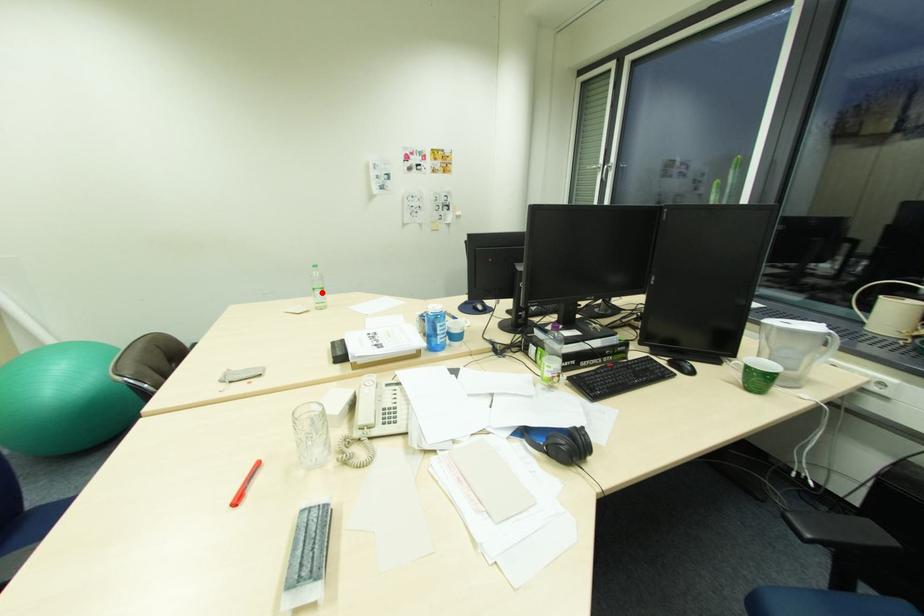
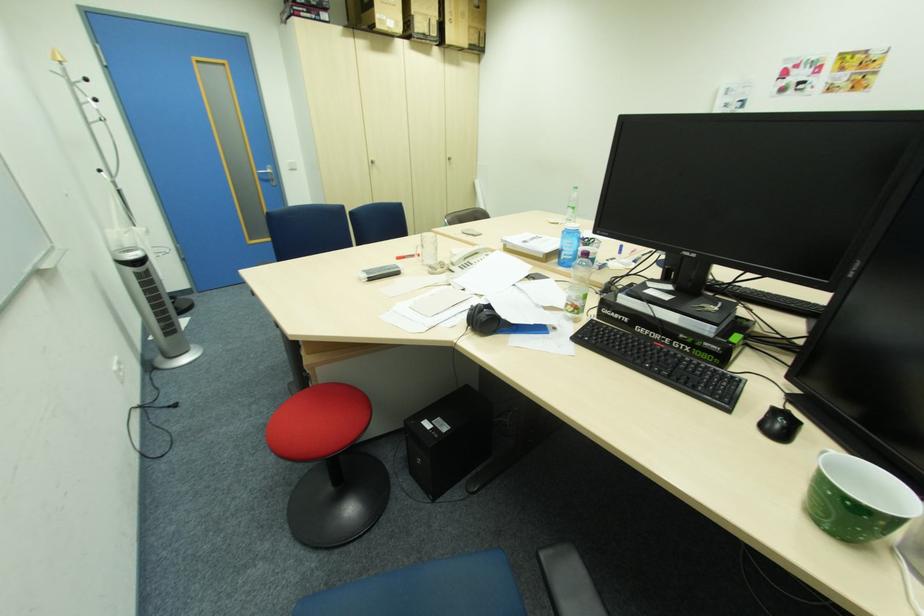
Locate, in the second image, the point that corresponds to the highlighted location in the first image.

(574, 209)